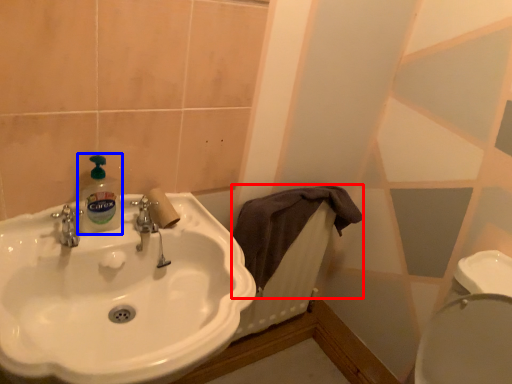
Question: Which object is closer to the camera taking this photo, bath towel (highlighted by a red box) or cleaning product (highlighted by a blue box)?

Choices:
 (A) bath towel
 (B) cleaning product

Answer: (B)